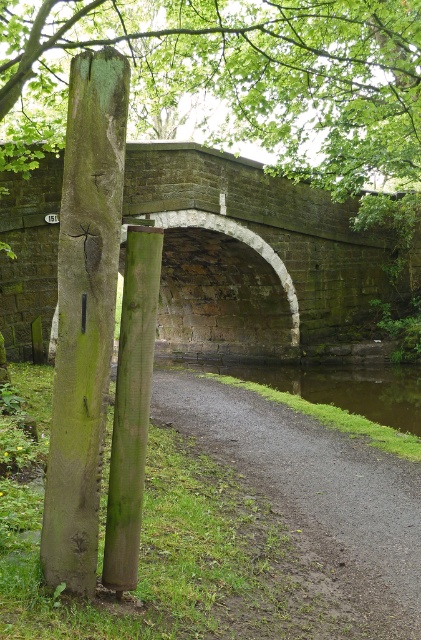
Which is below, gray gravel path at lower center or green mossy wood pole at left?

Positioned lower is gray gravel path at lower center.

Which is more to the left, gray gravel path at lower center or green mossy wood pole at left?

green mossy wood pole at left

Which is behind, point (346, 532) or point (101, 412)?

The point (346, 532) is more distant.

Image resolution: width=421 pixels, height=640 pixels. I want to click on gray gravel path at lower center, so click(314, 497).

Can you confirm if stone arch bridge at center is thinner than green mossy wood pole at left?

No, stone arch bridge at center is not thinner than green mossy wood pole at left.

Is stone arch bridge at center further to camera compared to green mossy wood pole at left?

Yes, stone arch bridge at center is behind green mossy wood pole at left.

Measure the distance between stone arch bridge at center and camera.

12.96 meters

Where is `stone arch bridge at center`? This screenshot has width=421, height=640. stone arch bridge at center is located at coordinates (258, 257).

Between stone arch bridge at center and gray gravel path at lower center, which one has more height?

stone arch bridge at center

The width and height of the screenshot is (421, 640). What do you see at coordinates (258, 257) in the screenshot?
I see `stone arch bridge at center` at bounding box center [258, 257].

Where is `stone arch bridge at center`? Image resolution: width=421 pixels, height=640 pixels. stone arch bridge at center is located at coordinates (258, 257).